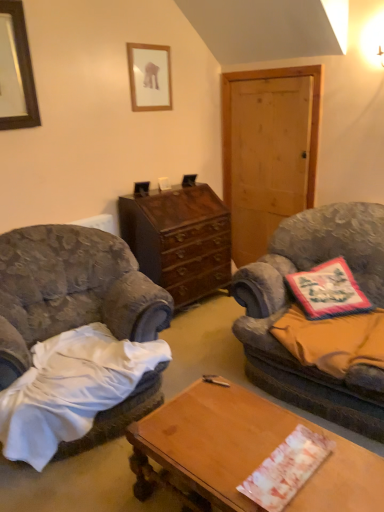
In order to click on vacant area on top of white paper at center, the 2th sheet from the top (from a real-world perspective) in this screenshot , I will do `click(284, 465)`.